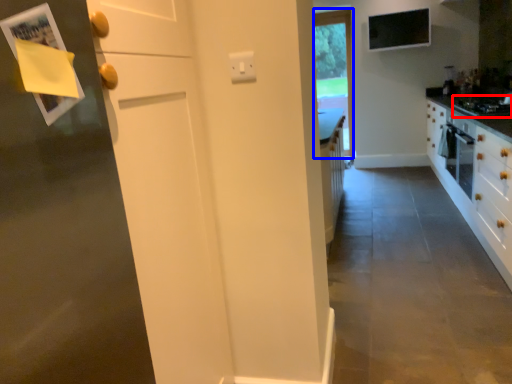
Question: Among these objects, which one is nearest to the camera, gas stove (highlighted by a red box) or window (highlighted by a blue box)?

Choices:
 (A) gas stove
 (B) window

Answer: (A)